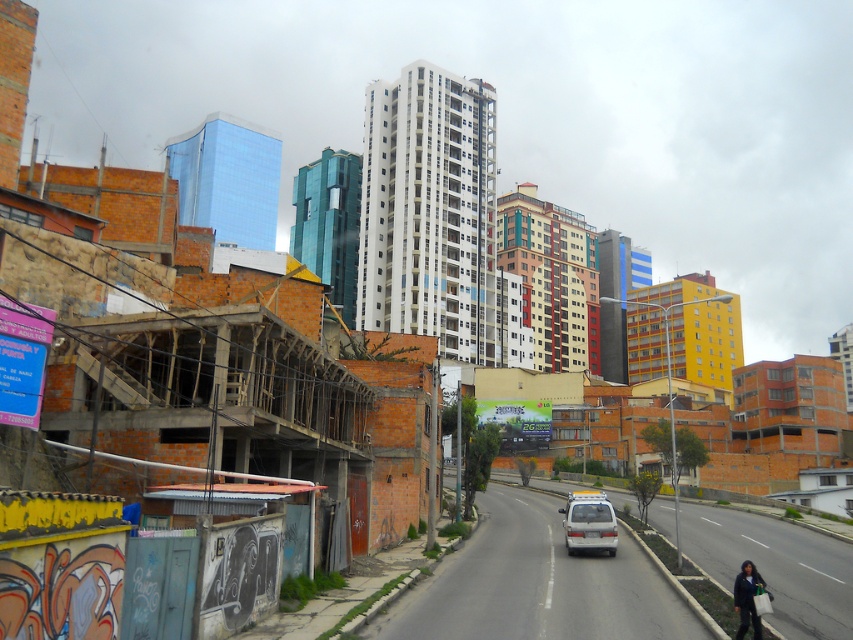
You are a delivery driver who needs to park your white matte van at center on the gray asphalt road at center. Can you safely park there without the van hitting the road?

The gray asphalt road at center is not as tall as the white matte van at center, so the van can safely park on the road without hitting it.

You are standing at the point marked as point (537,584) in the image. What is the name of the object located exactly at this point?

The gray asphalt road at center is located at point (537,584).